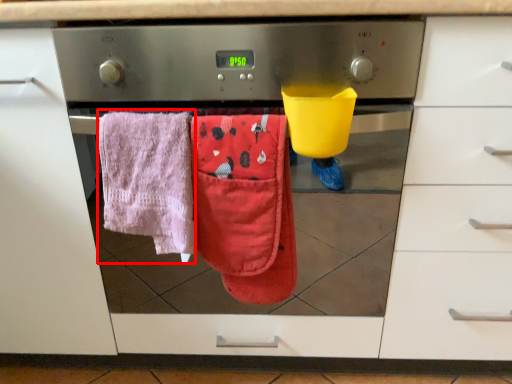
Question: Observing the image, what is the correct spatial positioning of beach towel (annotated by the red box) in reference to beach towel?

Choices:
 (A) left
 (B) right

Answer: (A)